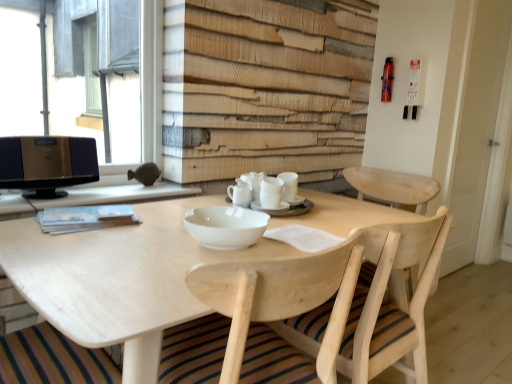
I want to click on vacant space situated on the left part of white matte cups at center, which ranks as the 1th tableware in left-to-right order, so click(182, 205).